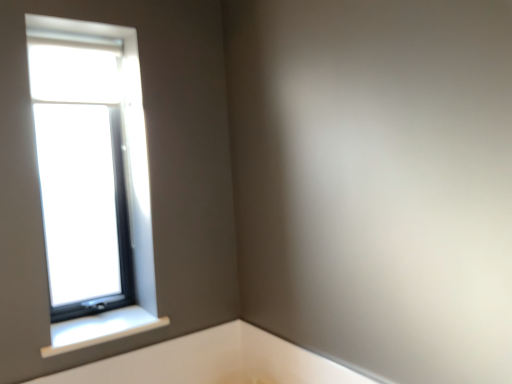
Question: From their relative heights in the image, would you say white plastic window sill at lower left is taller or shorter than clear glass window at upper left?

Choices:
 (A) short
 (B) tall

Answer: (A)

Question: Would you say white plastic window sill at lower left is inside or outside clear glass window at upper left?

Choices:
 (A) outside
 (B) inside

Answer: (A)

Question: Is white plastic window sill at lower left wider or thinner than clear glass window at upper left?

Choices:
 (A) thin
 (B) wide

Answer: (B)

Question: Considering the positions of clear glass window at upper left and white plastic window sill at lower left in the image, is clear glass window at upper left bigger or smaller than white plastic window sill at lower left?

Choices:
 (A) small
 (B) big

Answer: (B)

Question: In terms of height, does clear glass window at upper left look taller or shorter compared to white plastic window sill at lower left?

Choices:
 (A) tall
 (B) short

Answer: (A)

Question: Would you say clear glass window at upper left is to the left or to the right of white plastic window sill at lower left in the picture?

Choices:
 (A) right
 (B) left

Answer: (B)

Question: Considering their positions, is clear glass window at upper left located in front of or behind white plastic window sill at lower left?

Choices:
 (A) front
 (B) behind

Answer: (B)